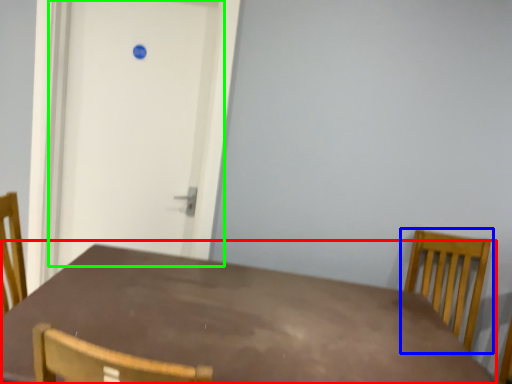
Question: Estimate the real-world distances between objects in this image. Which object is farther from table (highlighted by a red box), chair (highlighted by a blue box) or door (highlighted by a green box)?

Choices:
 (A) chair
 (B) door

Answer: (A)